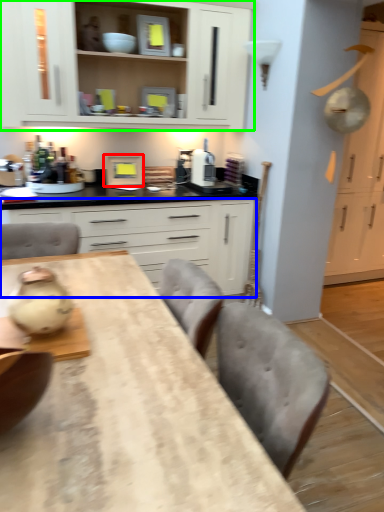
Question: Based on their relative distances, which object is farther from appliance (highlighted by a red box)? Choose from cabinetry (highlighted by a blue box) and cabinetry (highlighted by a green box).

Choices:
 (A) cabinetry
 (B) cabinetry

Answer: (B)